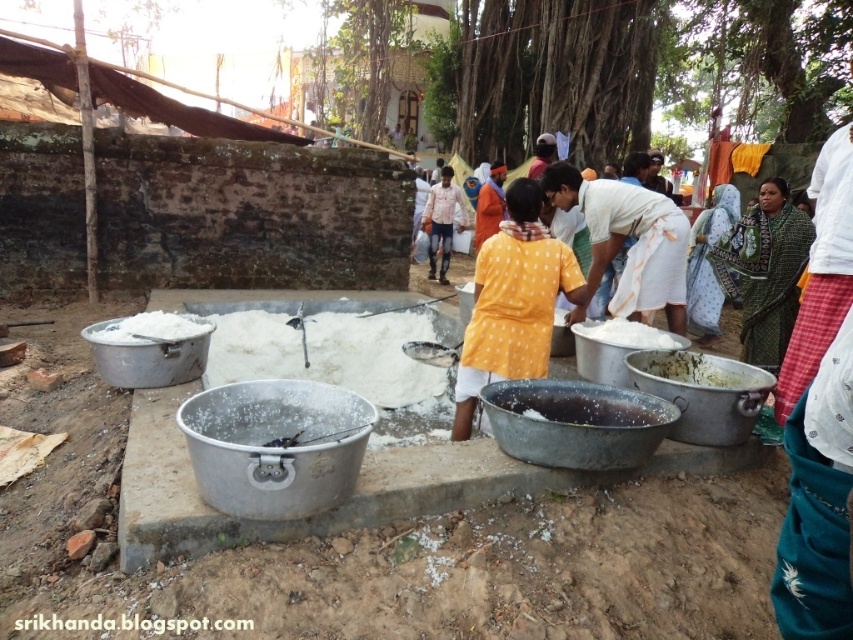
You are standing in the outdoor scene and want to walk from point A to point B. Point A is at coordinate point (454, 198) and point B is at coordinate point (614, 344). Which point is closer to you when you start walking?

Point A at coordinate point (454, 198) is closer to you because it is further to the camera than point B at coordinate point (614, 344), so when you start walking, point A is nearer.

You are a photographer standing at the edge of the platform where the basins are placed. You want to capture a photo that includes both the white matte food at center and the white matte salt at center. Given that your camera has a maximum focal length that allows capturing objects up to 3 meters apart, will you be able to include both in the frame?

The white matte food at center and white matte salt at center are 2.80 meters apart from each other, which is within the camera maximum focal length of 3 meters. Therefore, you can include both in the frame.

You are a photographer trying to capture the entire scene with a camera that has a limited field of view. You notice the yellow dotted shirt at center and the blue printed saree at center. Which of these two items would require you to zoom in more to include them fully in the photo?

The yellow dotted shirt at center occupies less space than the blue printed saree at center, so you would need to zoom in more to capture the yellow dotted shirt at center in its entirety.